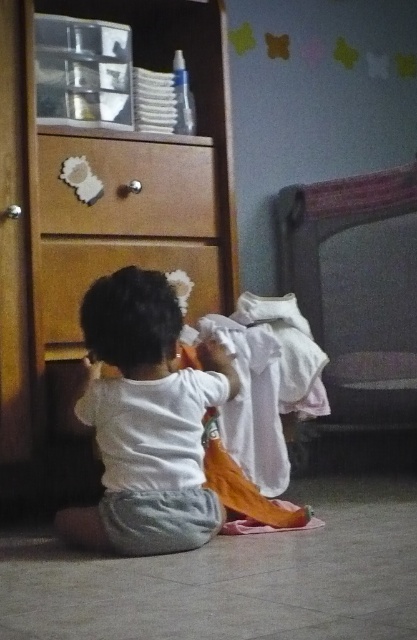
Consider the image. Can you confirm if dark gray fabric bunk bed at right is positioned to the right of white cotton shirt at lower center?

Indeed, dark gray fabric bunk bed at right is positioned on the right side of white cotton shirt at lower center.

Who is more distant from viewer, (333,332) or (205,362)?

The point (333,332) is more distant.

What do you see at coordinates (356, 314) in the screenshot? The width and height of the screenshot is (417, 640). I see `dark gray fabric bunk bed at right` at bounding box center [356, 314].

You are a GUI agent. You are given a task and a screenshot of the screen. Output one action in this format:
    pyautogui.click(x=<x>, y=<y>)
    Task: Click on the dark gray fabric bunk bed at right
    The image size is (417, 640).
    Given the screenshot: What is the action you would take?
    pyautogui.click(x=356, y=314)

Is white cotton shirt at lower center below wooden drawer at lower center?

Yes.

Does point (122, 390) come behind point (191, 292)?

No.

This screenshot has width=417, height=640. Identify the location of white cotton shirt at lower center. (145, 420).

Between wooden dresser at left and white cotton shirt at lower center, which one appears on the left side from the viewer's perspective?

wooden dresser at left is more to the left.

Describe the element at coordinates (97, 227) in the screenshot. The height and width of the screenshot is (640, 417). I see `wooden dresser at left` at that location.

The width and height of the screenshot is (417, 640). In order to click on wooden dresser at left in this screenshot , I will do `click(97, 227)`.